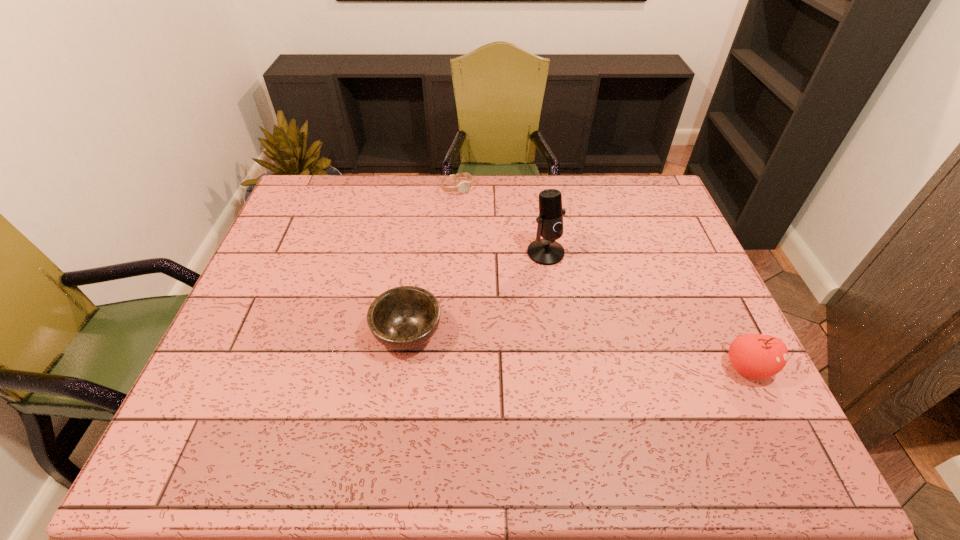
Where is `blank space at the near edge`? Image resolution: width=960 pixels, height=540 pixels. blank space at the near edge is located at coordinates (423, 386).

Locate an element on the screen. This screenshot has height=540, width=960. vacant space at the left edge of the desktop is located at coordinates (300, 285).

This screenshot has height=540, width=960. Find the location of `vacant space at the right edge`. vacant space at the right edge is located at coordinates (711, 336).

The image size is (960, 540). In the image, there is a desktop. Identify the location of vacant space at the near left corner. (204, 383).

Where is `free space at the far right corner of the desktop`? The width and height of the screenshot is (960, 540). free space at the far right corner of the desktop is located at coordinates (631, 200).

Image resolution: width=960 pixels, height=540 pixels. Identify the location of vacant space at the near right corner of the desktop. coord(688,382).

The width and height of the screenshot is (960, 540). What are the coordinates of `empty location between the farthest object and the third nearest object` in the screenshot? It's located at (501, 220).

Locate an element on the screen. The width and height of the screenshot is (960, 540). blank region between the bowl and the rightmost object is located at coordinates (578, 350).

Locate an element on the screen. The height and width of the screenshot is (540, 960). vacant space in between the farthest object and the second farthest object is located at coordinates (501, 220).

Where is `free area in between the shortest object and the tallest object`? free area in between the shortest object and the tallest object is located at coordinates (501, 220).